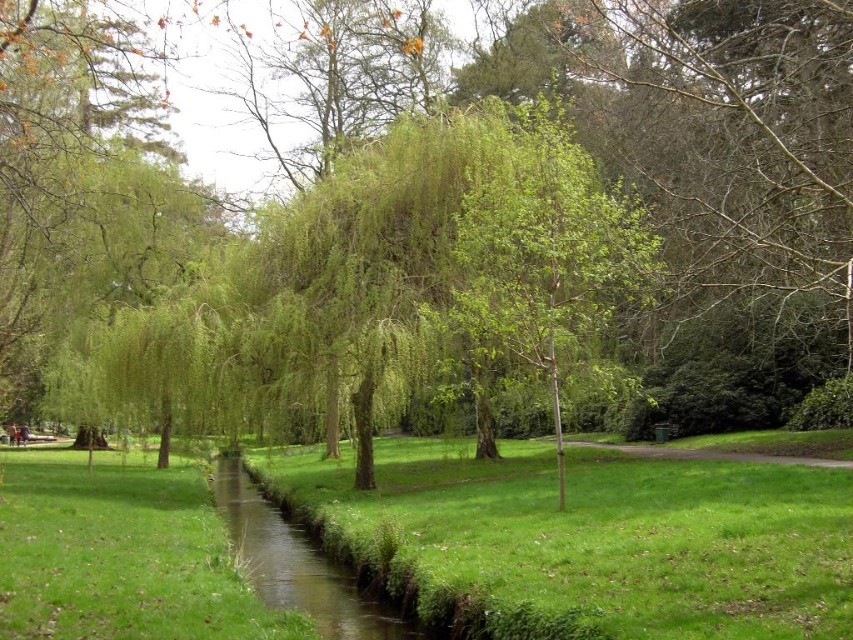
You are standing at the point labeled as point (392, 280) in the park scene. What object are you directly facing?

The point (392, 280) corresponds to the green leafy willow at center, so you are directly facing the green leafy willow at center.

You are standing in the park and want to take a photo of the green leafy willow at center. If your camera can focus on objects up to 10 meters away, will you need to move closer or farther away to capture it clearly?

The green leafy willow at center is 12.36 meters from camera, which is beyond the camera focus range of 10 meters. You need to move closer to the green leafy willow at center to ensure it is within the focus range.